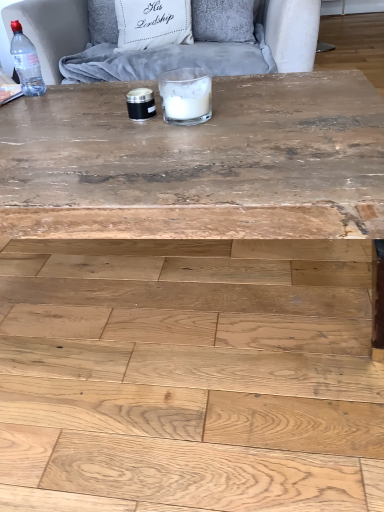
At what (x,y) coordinates should I click in order to perform the action: click on free point to the left of white glass candle at center. Please return your answer as a coordinate pair (x, y). This screenshot has width=384, height=512. Looking at the image, I should click on (114, 132).